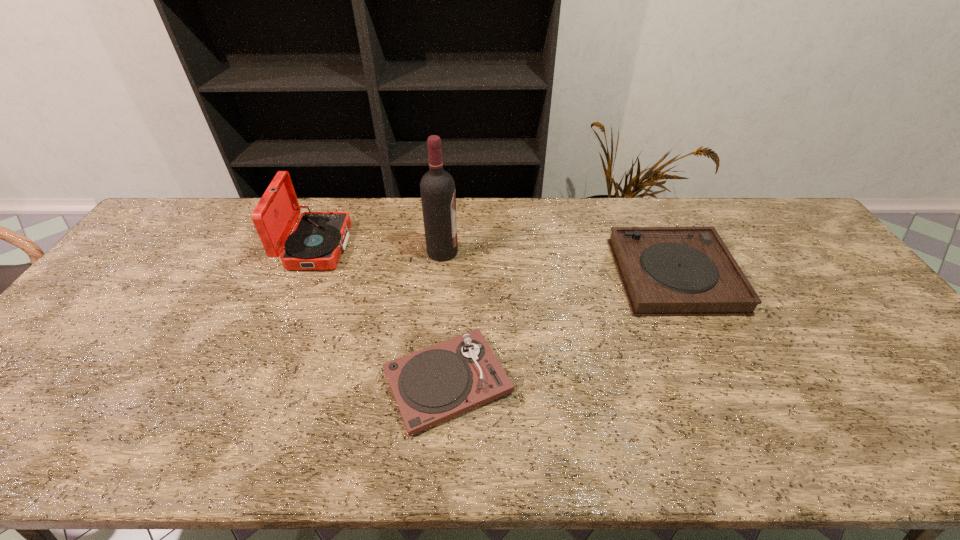
Find the location of a particular element. The height and width of the screenshot is (540, 960). object that is at the near edge is located at coordinates (432, 385).

The height and width of the screenshot is (540, 960). Identify the location of vacant position at the far edge of the desktop. (729, 228).

Where is `free region at the near edge`? This screenshot has height=540, width=960. free region at the near edge is located at coordinates (517, 435).

Locate an element on the screen. vacant space at the right edge of the desktop is located at coordinates (906, 395).

The image size is (960, 540). Find the location of `blank region between the rightmost object and the tallest object`. blank region between the rightmost object and the tallest object is located at coordinates (559, 264).

Find the location of a particular element. The image size is (960, 540). vacant space in between the rightmost phonograph_record and the wine bottle is located at coordinates (559, 264).

At what (x,y) coordinates should I click in order to perform the action: click on free area in between the rightmost phonograph_record and the second phonograph_record from right to left. Please return your answer as a coordinate pair (x, y). Looking at the image, I should click on click(561, 329).

The height and width of the screenshot is (540, 960). In order to click on free space between the leftmost phonograph_record and the nearest phonograph_record in this screenshot , I will do [x=382, y=314].

Locate an element on the screen. empty space between the nearest object and the leftmost phonograph_record is located at coordinates (382, 314).

I want to click on vacant space in between the second phonograph_record from left to right and the rightmost phonograph_record, so click(x=561, y=329).